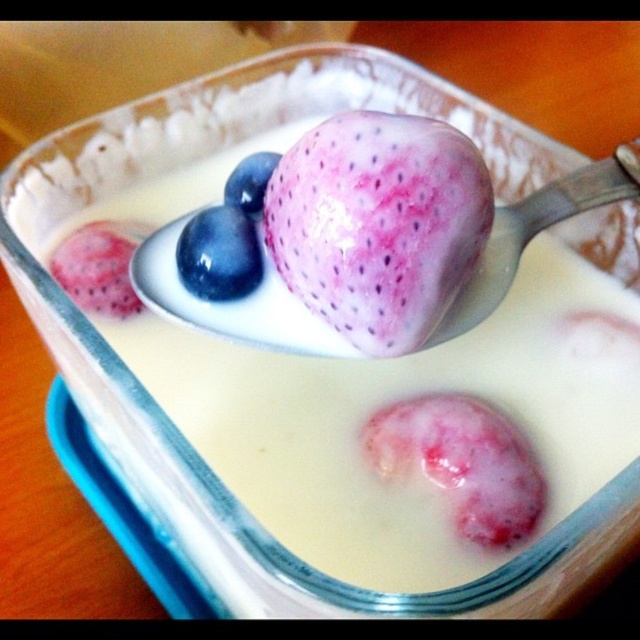
Question: Which object is positioned closest to the satin silver spoon at upper center?

Choices:
 (A) blue matte/black glossy blueberry at upper center
 (B) pink glossy strawberry at upper center
 (C) blue glossy blueberry at center

Answer: (C)

Question: Is pink glossy fruit at center wider than pink glossy strawberry at upper center?

Choices:
 (A) no
 (B) yes

Answer: (B)

Question: Is blue glossy blueberry at center wider than pink glossy strawberry at upper center?

Choices:
 (A) no
 (B) yes

Answer: (A)

Question: Among these points, which one is nearest to the camera?

Choices:
 (A) (76, 289)
 (B) (600, 172)
 (C) (356, 113)
 (D) (256, 170)

Answer: (C)

Question: Considering the real-world distances, which object is closest to the blue matte/black glossy blueberry at upper center?

Choices:
 (A) satin silver spoon at upper center
 (B) pink glossy fruit at center
 (C) blue glossy blueberry at center
 (D) pink glossy strawberry at upper center

Answer: (C)

Question: Can you confirm if blue glossy blueberry at center is positioned to the left of blue matte/black glossy blueberry at upper center?

Choices:
 (A) yes
 (B) no

Answer: (A)